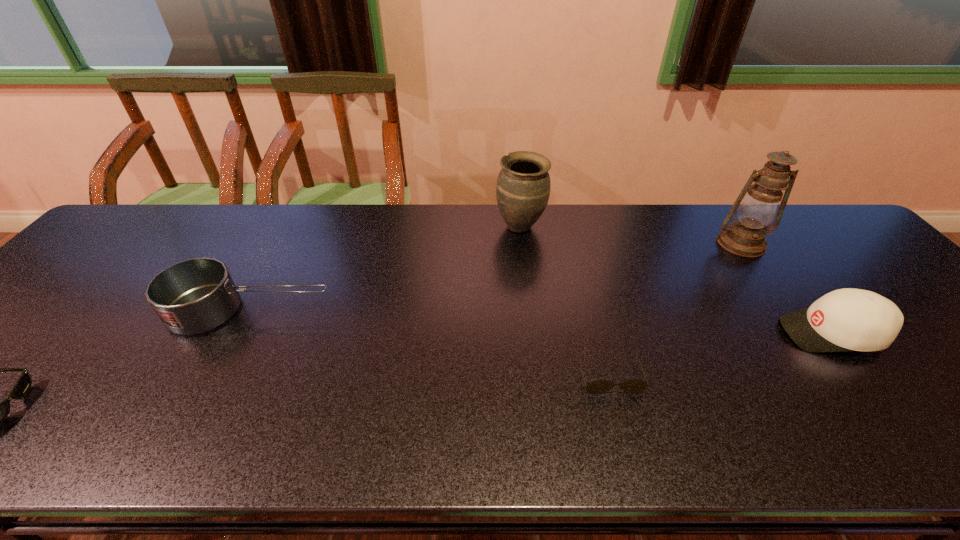
Locate an element on the screen. free point between the second tallest object and the saucepan is located at coordinates (386, 268).

Where is `free space between the tallest object and the saucepan`? free space between the tallest object and the saucepan is located at coordinates (496, 277).

Find the location of a particular element. The height and width of the screenshot is (540, 960). free spot between the baseball cap and the urn is located at coordinates (676, 280).

Locate an element on the screen. free space between the fifth object from right to left and the oil lamp is located at coordinates (496, 277).

The image size is (960, 540). Find the location of `free space that is in between the urn and the third object from right to left`. free space that is in between the urn and the third object from right to left is located at coordinates (564, 301).

You are a GUI agent. You are given a task and a screenshot of the screen. Output one action in this format:
    pyautogui.click(x=<x>, y=<y>)
    Task: Click on the vacant point located between the third object from left to right and the fifth object from right to left
    The width and height of the screenshot is (960, 540).
    Given the screenshot: What is the action you would take?
    pyautogui.click(x=386, y=268)

The image size is (960, 540). I want to click on object that is the fifth closest to the fourth object from right to left, so click(x=0, y=410).

You are a GUI agent. You are given a task and a screenshot of the screen. Output one action in this format:
    pyautogui.click(x=<x>, y=<y>)
    Task: Click on the object that is the closest to the fourth object from right to left
    The height and width of the screenshot is (540, 960).
    Given the screenshot: What is the action you would take?
    pyautogui.click(x=633, y=386)